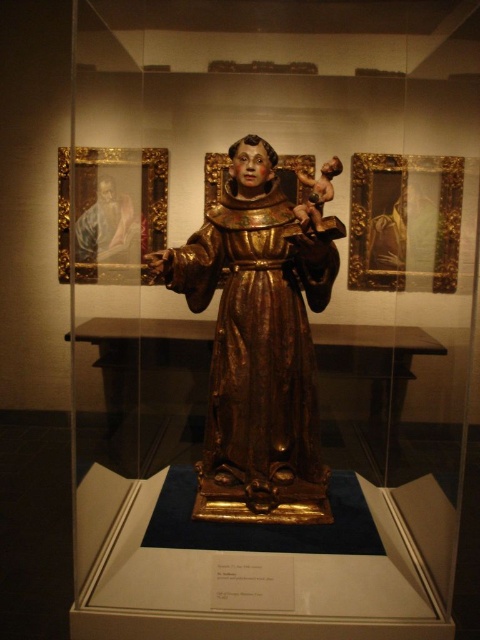
Question: Where is gold polished wood statue at center located in relation to matte gold frame at upper left in the image?

Choices:
 (A) right
 (B) left

Answer: (A)

Question: Can you confirm if gold polished wood statue at center is thinner than matte gold frame at upper left?

Choices:
 (A) yes
 (B) no

Answer: (B)

Question: Does gold polished wood statue at center appear under matte gold frame at upper left?

Choices:
 (A) no
 (B) yes

Answer: (B)

Question: Among these points, which one is farthest from the camera?

Choices:
 (A) 131,211
 (B) 283,314

Answer: (A)

Question: Which point appears farthest from the camera in this image?

Choices:
 (A) (272, 264)
 (B) (117, 160)

Answer: (B)

Question: Among these points, which one is nearest to the camera?

Choices:
 (A) (126, 189)
 (B) (287, 353)

Answer: (B)